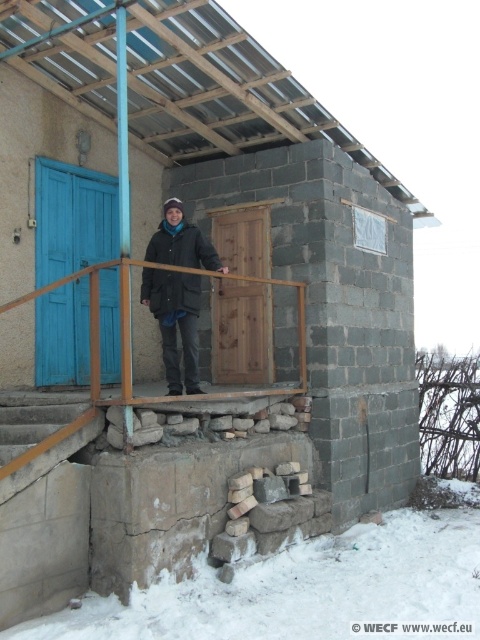
You are a delivery person trying to reach the wooden door at center. There is white powdery snow at lower center in your path. Can you walk through the snow to reach the door?

The white powdery snow at lower center is larger in size than wooden door at center, so the snow might be deep enough to obstruct your path. It is advisable to find an alternative route to reach the wooden door at center safely.

You are a delivery person trying to reach the wooden door at center. There is white powdery snow at lower center in your path. Will you need to step over the snow to reach the door?

The white powdery snow at lower center is not as tall as the wooden door at center, so you can step over the snow to reach the wooden door at center.

You are standing at the base of the concrete stairs at lower left and want to reach the dark green matte jacket at center. Which direction should you move to get closer to the jacket?

The concrete stairs at lower left is closer to the viewer than the dark green matte jacket at center, so you should move forward away from the stairs towards the jacket to get closer.